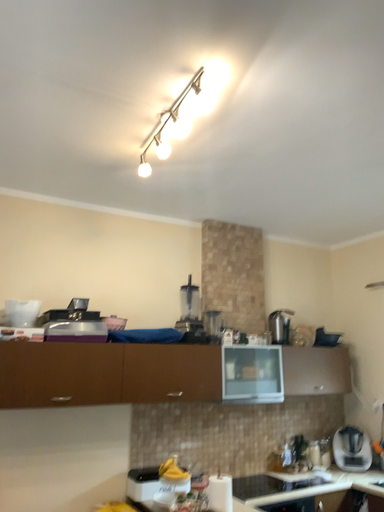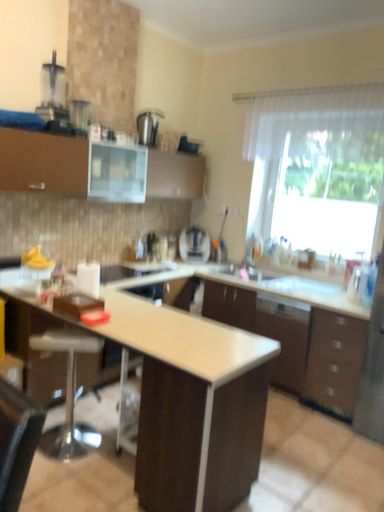
Question: Which way did the camera rotate in the video?

Choices:
 (A) rotated downward
 (B) rotated upward

Answer: (A)